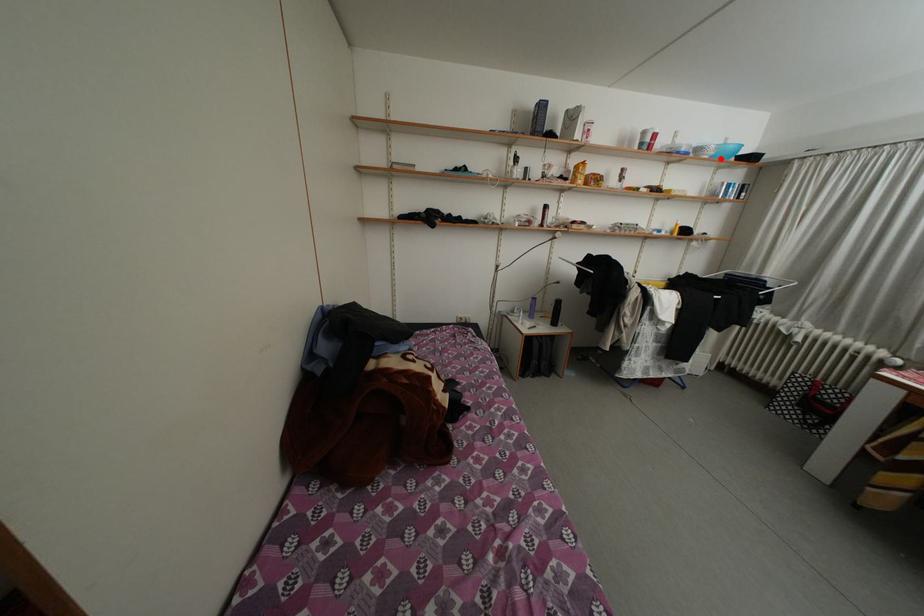
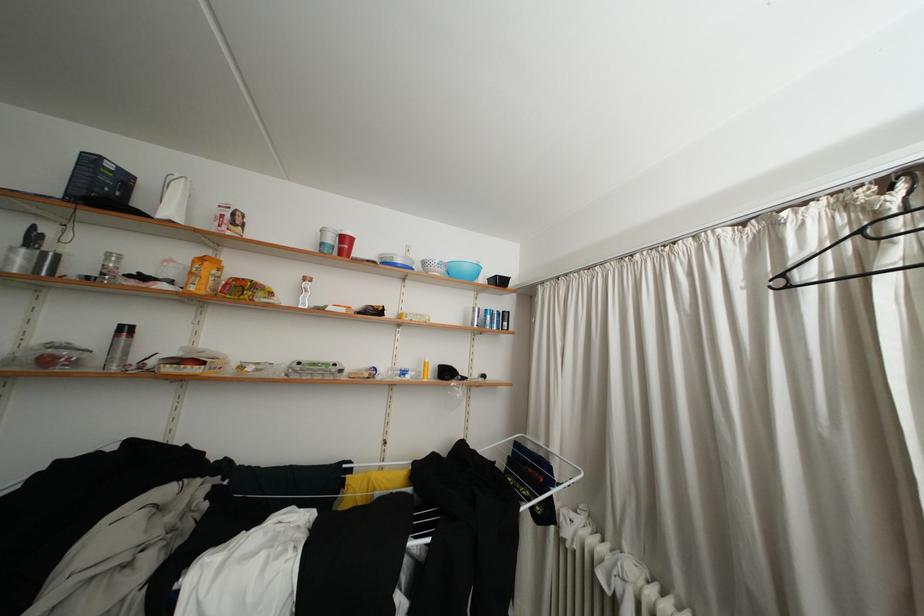
In the second image, find the point that corresponds to the highlighted location in the first image.

(451, 276)